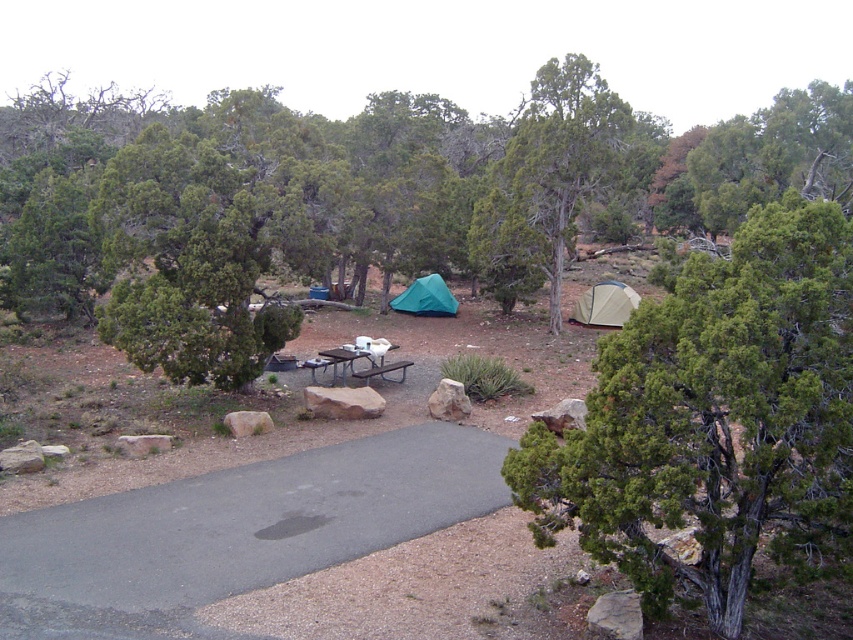
Which is more to the right, beige canvas tent at center-right or green fabric tent at center?

Positioned to the right is beige canvas tent at center-right.

Can you confirm if beige canvas tent at center-right is positioned below green fabric tent at center?

Yes, beige canvas tent at center-right is below green fabric tent at center.

Find the location of a particular element. This screenshot has width=853, height=640. beige canvas tent at center-right is located at coordinates (605, 305).

Looking at this image, can you confirm if brown metal picnic table at center is wider than green fabric tent at center?

No.

Which is below, brown metal picnic table at center or green fabric tent at center?

brown metal picnic table at center

Image resolution: width=853 pixels, height=640 pixels. What do you see at coordinates (363, 358) in the screenshot?
I see `brown metal picnic table at center` at bounding box center [363, 358].

Where is `brown metal picnic table at center`? The width and height of the screenshot is (853, 640). brown metal picnic table at center is located at coordinates (363, 358).

Can you confirm if green fabric tent at center is smaller than brown wooden picnic table at center?

Incorrect, green fabric tent at center is not smaller in size than brown wooden picnic table at center.

Does green fabric tent at center appear on the right side of brown wooden picnic table at center?

Yes, green fabric tent at center is to the right of brown wooden picnic table at center.

Who is more distant from viewer, [437,301] or [360,353]?

The point [437,301] is more distant.

Locate an element on the screen. The image size is (853, 640). green fabric tent at center is located at coordinates (426, 298).